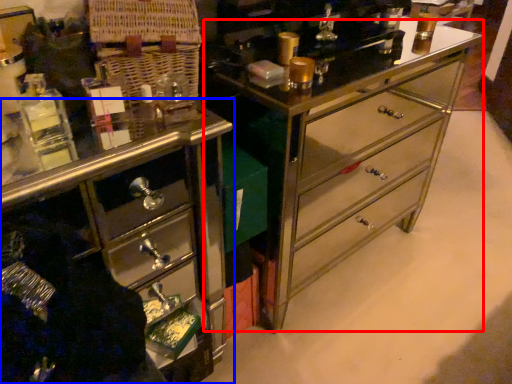
Question: Among these objects, which one is farthest to the camera, counter (highlighted by a red box) or chest of drawers (highlighted by a blue box)?

Choices:
 (A) counter
 (B) chest of drawers

Answer: (A)